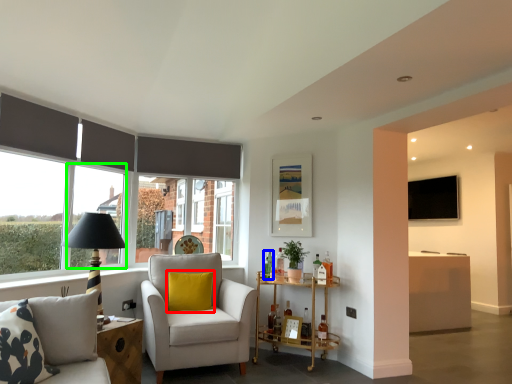
Question: Considering the real-world distances, which object is closest to pillow (highlighted by a red box)? bottle (highlighted by a blue box) or window (highlighted by a green box).

Choices:
 (A) bottle
 (B) window

Answer: (A)